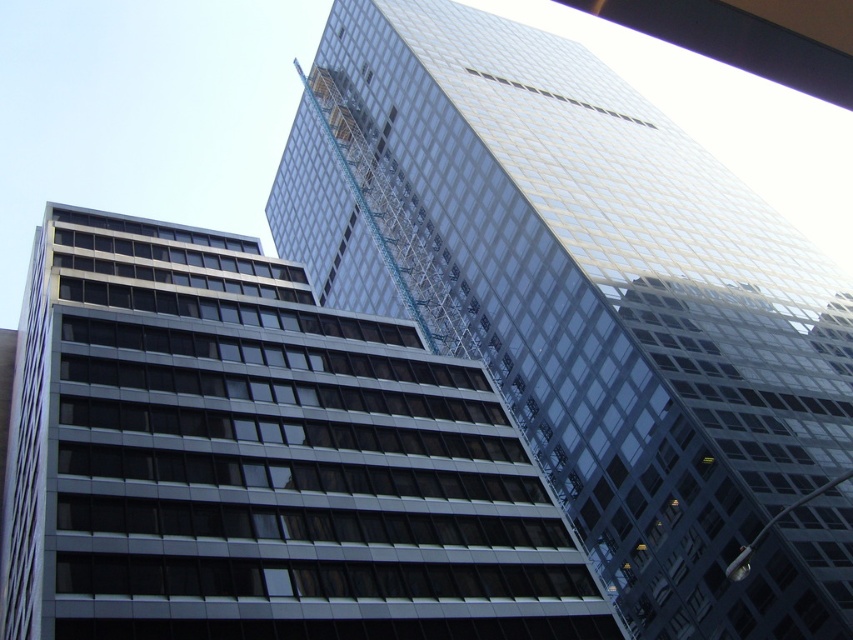
Question: Is transparent glass tower at upper center to the right of clear glass building at center from the viewer's perspective?

Choices:
 (A) yes
 (B) no

Answer: (A)

Question: Which object appears closest to the camera in this image?

Choices:
 (A) clear glass building at center
 (B) transparent glass tower at upper center

Answer: (A)

Question: Considering the relative positions of transparent glass tower at upper center and clear glass building at center in the image provided, where is transparent glass tower at upper center located with respect to clear glass building at center?

Choices:
 (A) above
 (B) below

Answer: (A)

Question: Which point appears farthest from the camera in this image?

Choices:
 (A) (648, 524)
 (B) (326, 518)

Answer: (A)

Question: Does transparent glass tower at upper center appear on the right side of clear glass building at center?

Choices:
 (A) no
 (B) yes

Answer: (B)